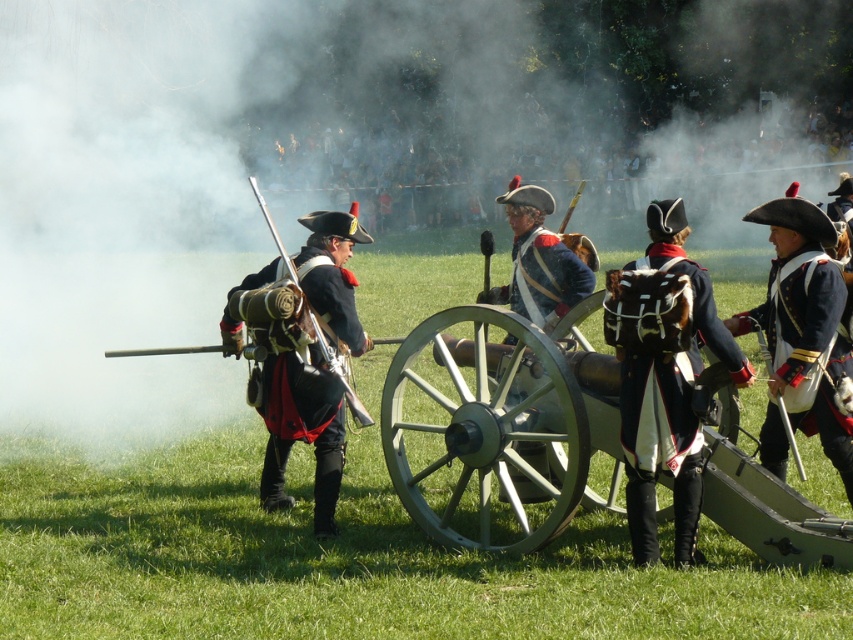
You are a spectator at the historical reenactment. You notice the smoke at center and the green wooden cannon at center. Which one appears wider from your viewpoint?

The smoke at center appears wider than the green wooden cannon at center because its width is larger.

You are a reenactment participant standing at the edge of the field. You need to move to the green wooden cannon at center. What are the coordinates of the cannon to navigate towards?

Answer: The green wooden cannon at center is located at coordinates point [498,429].

You are a visitor at the historical reenactment and want to take a photo of the black leather uniform at center. Your camera has a minimum focusing distance of 10 meters. Can you take a clear photo from your current position?

The black leather uniform at center and viewer are 9.13 meters apart. Since the minimum focusing distance is 10 meters, you are too close to take a clear photo. Move back to at least 10 meters away.